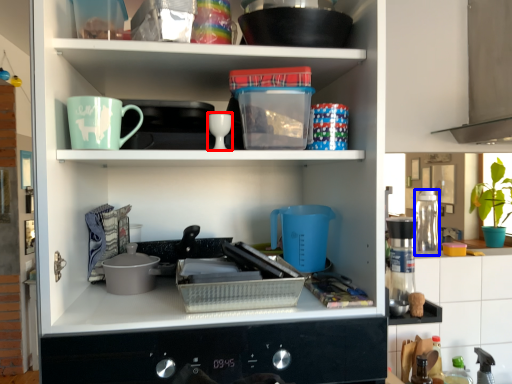
Question: Which object appears farthest to the camera in this image, tableware (highlighted by a red box) or appliance (highlighted by a blue box)?

Choices:
 (A) tableware
 (B) appliance

Answer: (B)